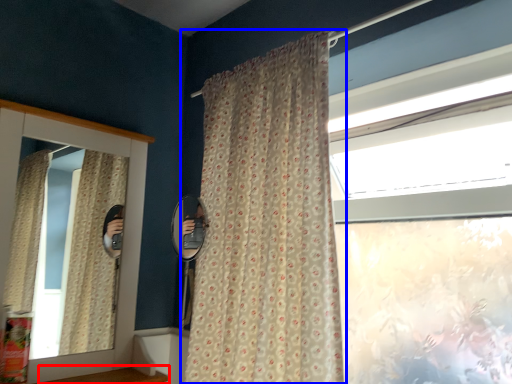
Question: Which object appears closest to the camera in this image, window sill (highlighted by a red box) or curtain (highlighted by a blue box)?

Choices:
 (A) window sill
 (B) curtain

Answer: (B)